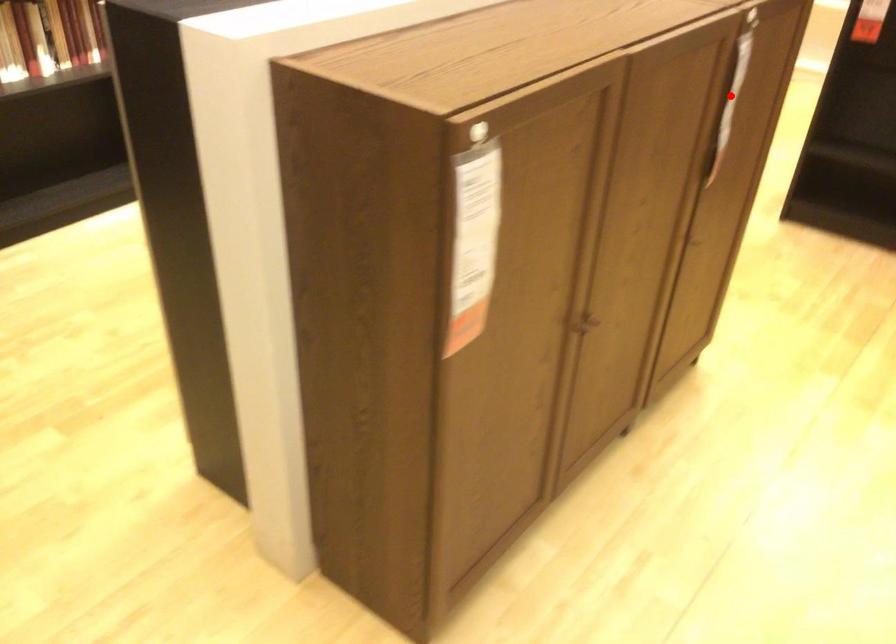
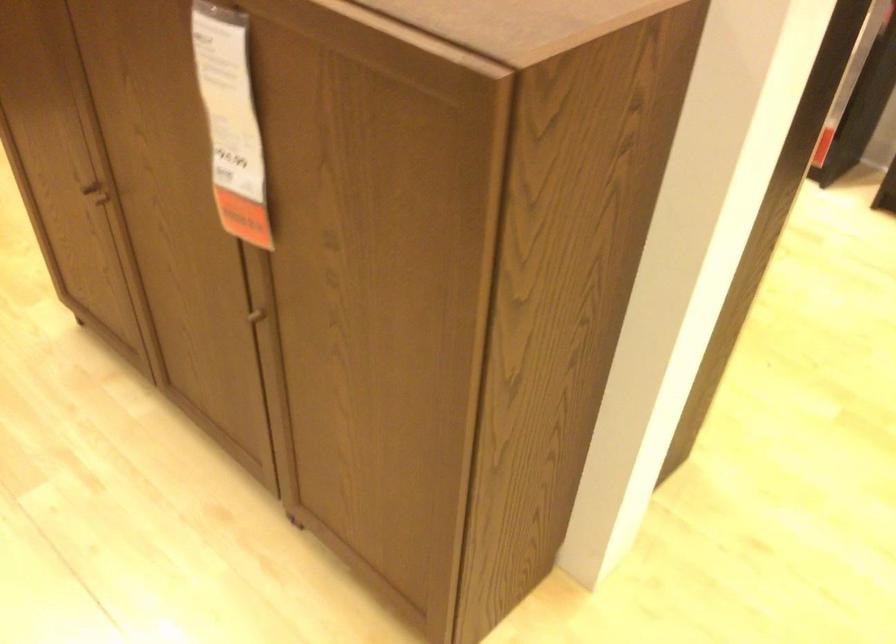
In the second image, find the point that corresponds to the highlighted location in the first image.

(230, 122)